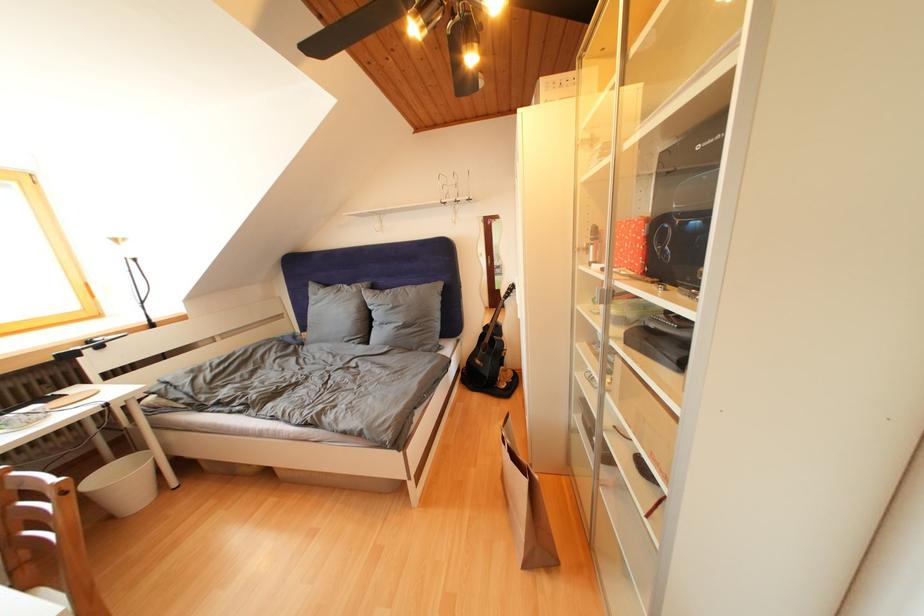
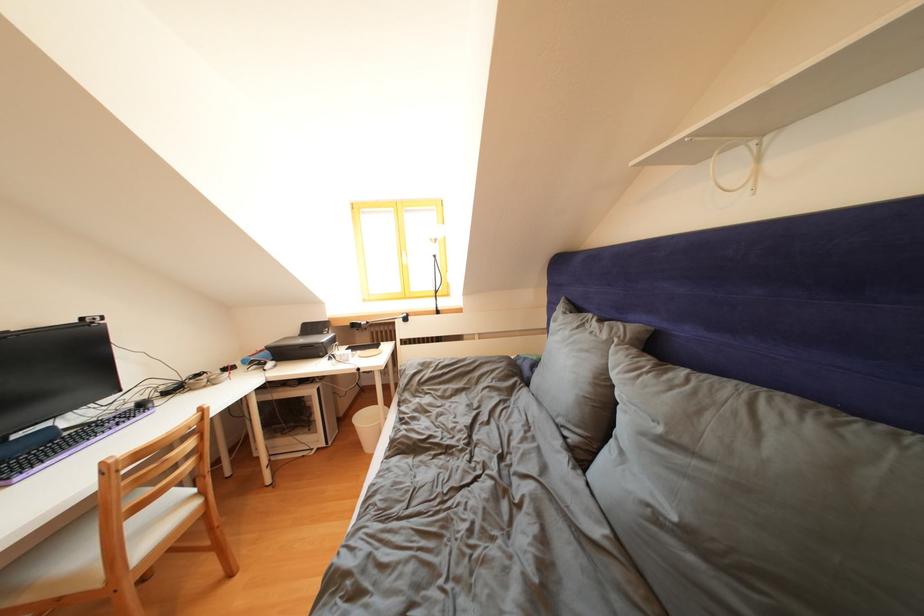
The point at (x=362, y=294) is marked in the first image. Where is the corresponding point in the second image?

(612, 341)